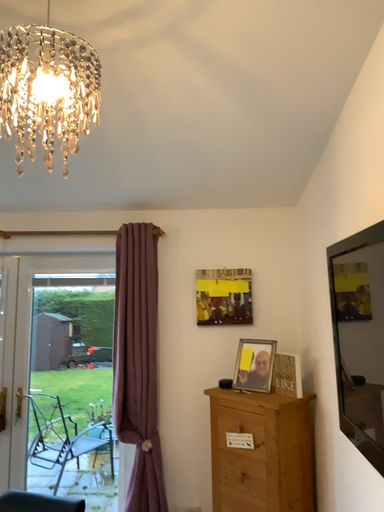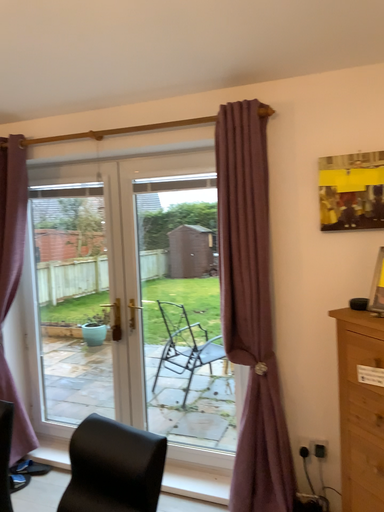
Question: Which way did the camera rotate in the video?

Choices:
 (A) rotated upward
 (B) rotated downward

Answer: (B)